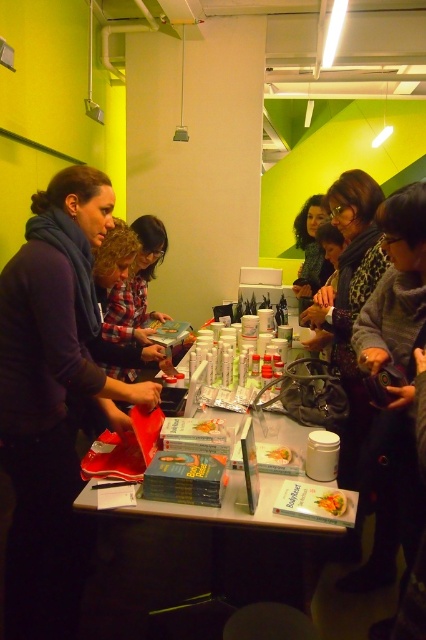
You have a small box that is 10 cm in width. You need to place it between the matte black scarf at left and the green leafy vegetable at center. Can you fit it there?

The matte black scarf at left might be wider than the green leafy vegetable at center, so the space between them may be sufficient to fit the 10 cm box. However, since the exact width difference is uncertain, it is advisable to measure the space before placing the box.

You are a participant at the event and want to grab the smooth plastic container at center without moving the green leafy vegetable at center. Is this possible?

The green leafy vegetable at center is in front of the smooth plastic container at center, so you can reach around or behind it to grab the smooth plastic container at center without moving the green leafy vegetable at center.

You are a participant at the event and want to grab the green leafy vegetable at center. However, there is a smooth plastic container at center in the way. Can you reach the vegetable without moving the container?

The green leafy vegetable at center is positioned under the smooth plastic container at center, so you can reach it by moving the container slightly aside.